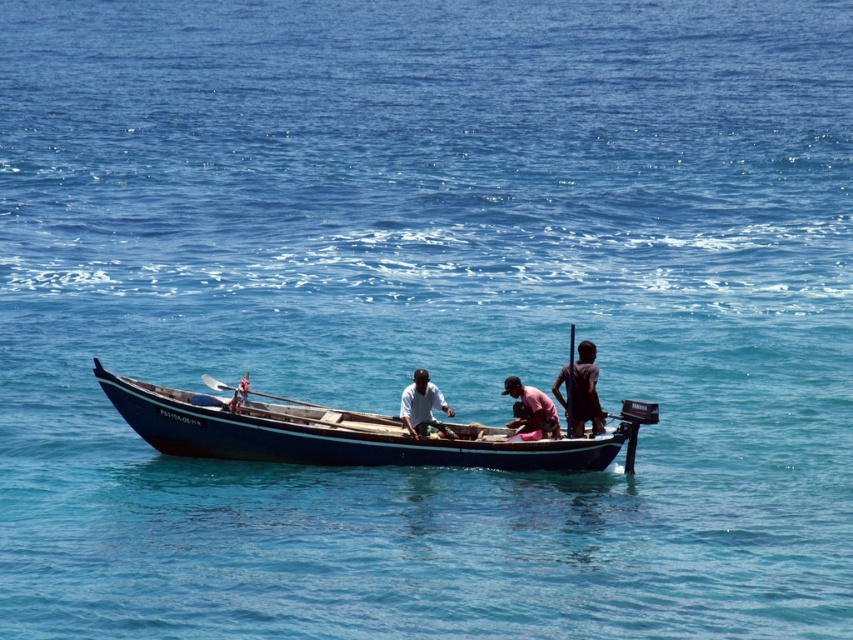
Question: Which point is farther from the camera taking this photo?

Choices:
 (A) (560, 467)
 (B) (399, 412)
 (C) (595, 355)

Answer: (C)

Question: Can you confirm if dark brown wooden boat at center is bigger than pink fabric at center?

Choices:
 (A) yes
 (B) no

Answer: (A)

Question: Which point is closer to the camera?

Choices:
 (A) white matte shirt at center
 (B) dark brown wooden boat at center
 (C) blue polished wood boat at center
 (D) pink fabric at center

Answer: (C)

Question: Can you confirm if dark brown wooden boat at center is bigger than white matte shirt at center?

Choices:
 (A) no
 (B) yes

Answer: (B)

Question: Does pink fabric at center have a lesser width compared to wooden paddle at center?

Choices:
 (A) no
 (B) yes

Answer: (B)

Question: Which point is farther to the camera?

Choices:
 (A) (508, 392)
 (B) (280, 397)

Answer: (B)